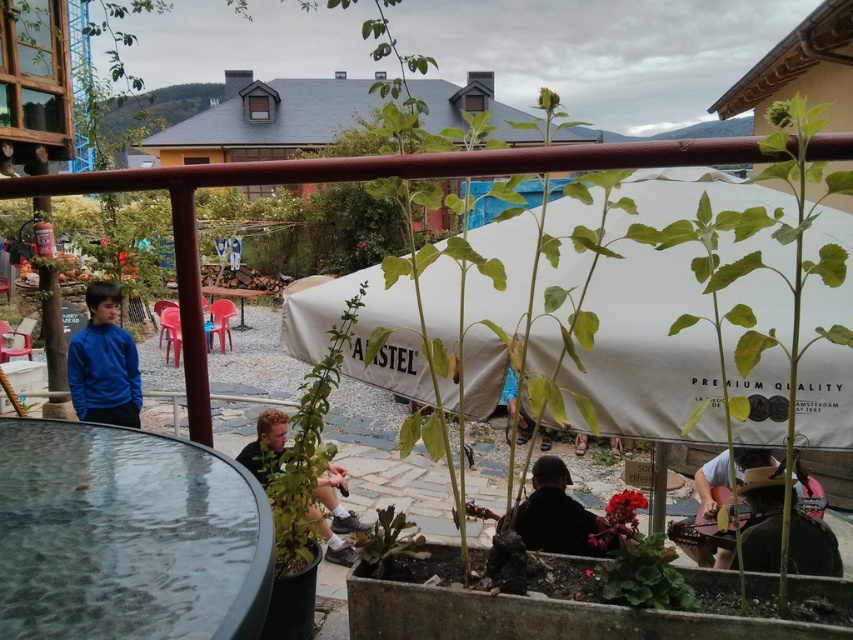
You are at a gathering and want to find the black matte shirt at center. Which direction should you look relative to the blue fleece jacket at left?

The black matte shirt at center is to the right of the blue fleece jacket at left.

You are a photographer trying to capture a clear shot of the black matte shirt at center and the blue fleece jacket at left. Which of these two items is closer to the camera?

The blue fleece jacket at left is closer to the camera because the black matte shirt at center is behind it.

You are at a gathering and want to move from the white canvas canopy at center to the green leafy plant at center. Which direction should you face to walk directly towards it?

The white canvas canopy at center is to the right of green leafy plant at center. So, to move from the white canvas canopy at center to the green leafy plant at center, you should face left and walk directly towards it.